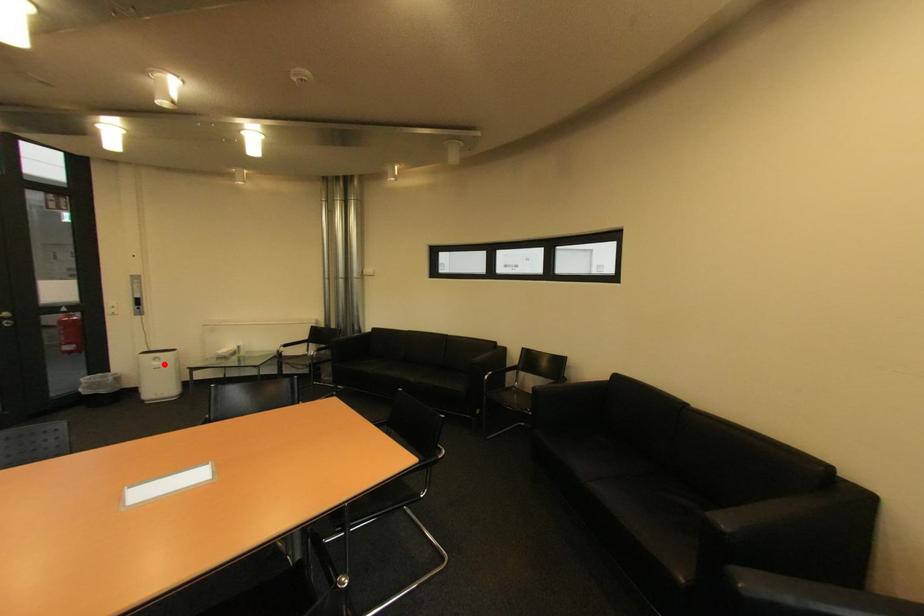
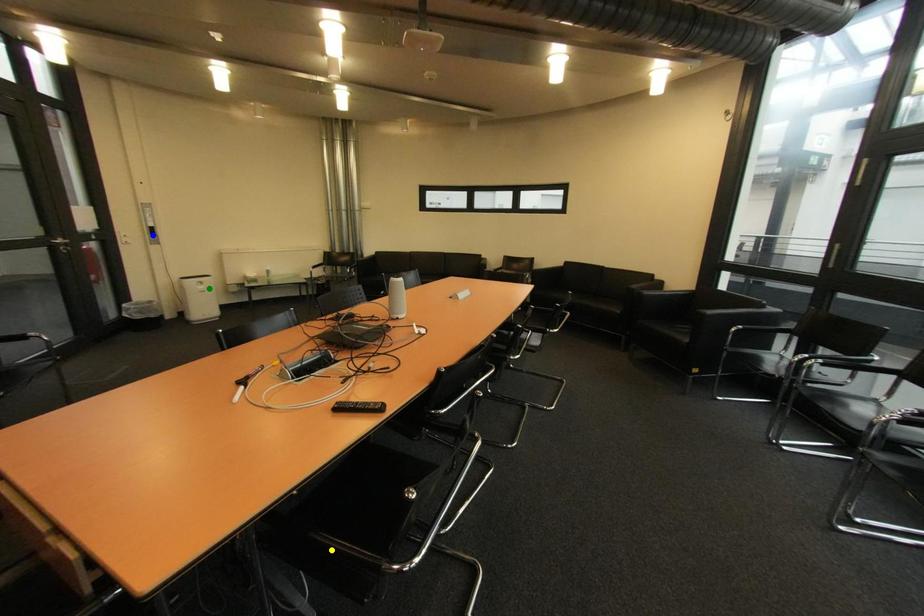
Question: I am providing you with two images of the same scene from different viewpoints. A red point is marked on the first image. You are given multiple points on the second image. Which point in image 2 represents the same 3d spot as the red point in image 1?

Choices:
 (A) yellow point
 (B) blue point
 (C) green point

Answer: (C)